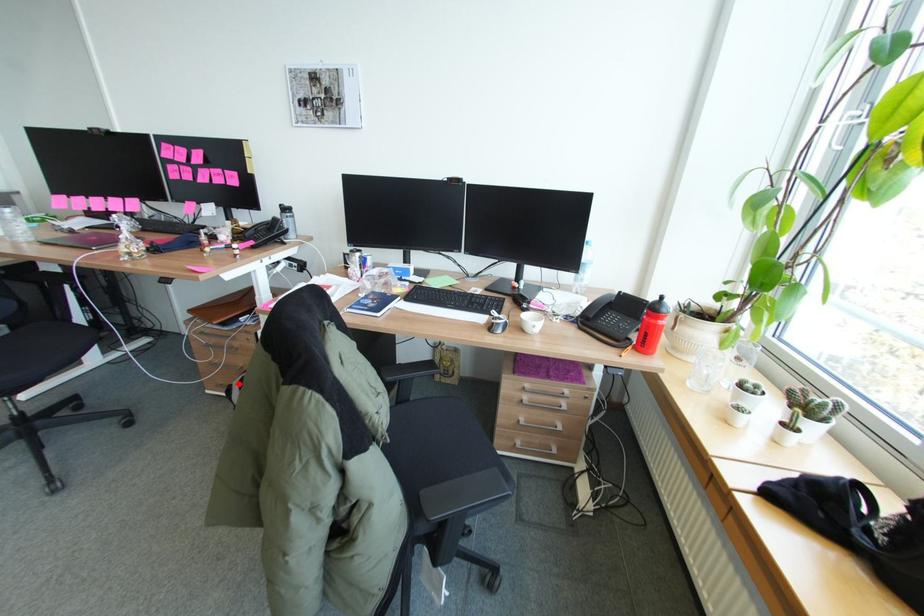
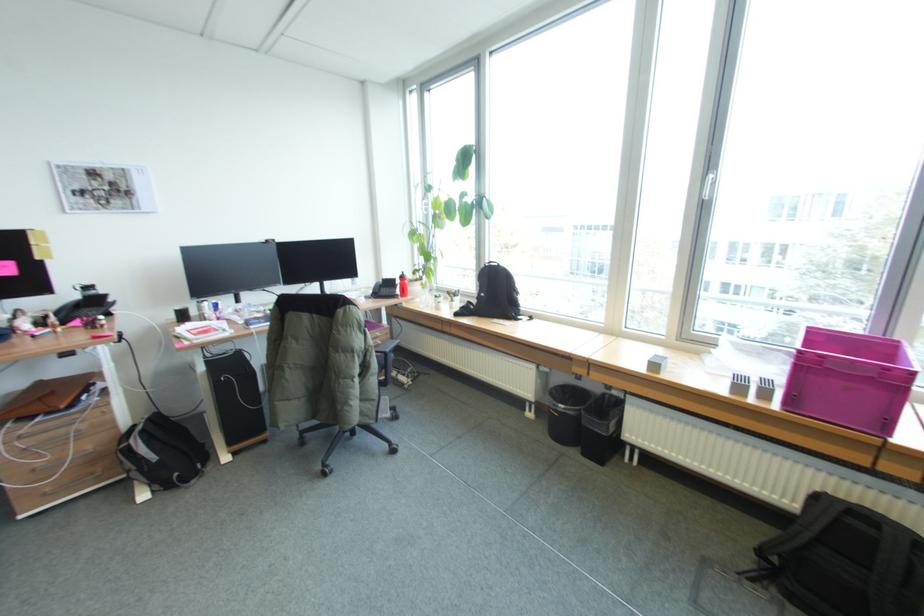
Find the pixel in the second image that matches the highlighted location in the first image.

(135, 444)